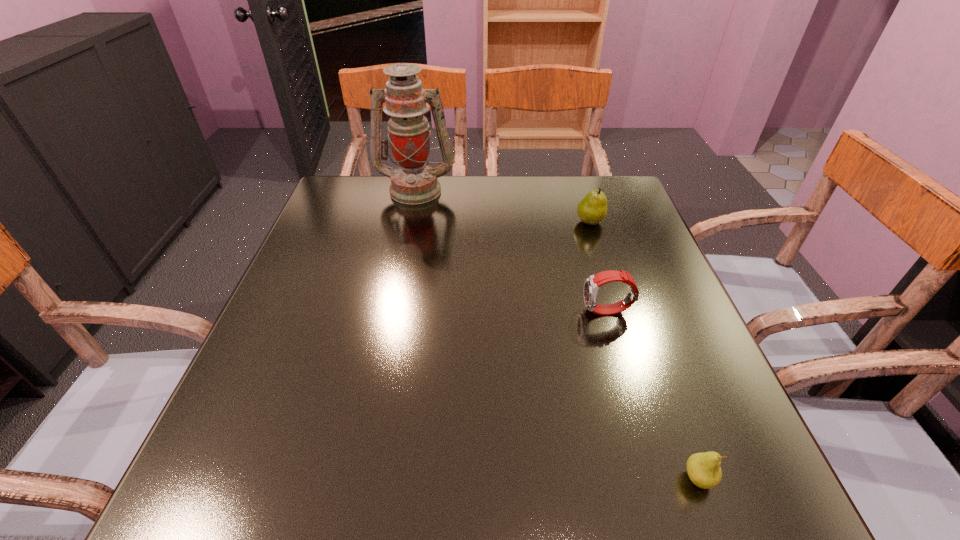
Image resolution: width=960 pixels, height=540 pixels. Find the location of `the tallest object`. the tallest object is located at coordinates (414, 182).

Locate an element on the screen. This screenshot has width=960, height=540. the farthest object is located at coordinates (414, 182).

Identify the location of the third nearest object. (592, 209).

What are the coordinates of `watch` in the screenshot? It's located at (592, 284).

At what (x,y) coordinates should I click in order to perform the action: click on the nearer pear. Please return your answer as a coordinate pair (x, y). The height and width of the screenshot is (540, 960). Looking at the image, I should click on (703, 469).

Locate an element on the screen. free space located 0.110m on the left of the leftmost object is located at coordinates (338, 189).

You are a GUI agent. You are given a task and a screenshot of the screen. Output one action in this format:
    pyautogui.click(x=<x>, y=<y>)
    Task: Click on the vacant space located on the front of the third nearest object
    
    Given the screenshot: What is the action you would take?
    tap(628, 339)

I want to click on vacant space located on the face of the third farthest object, so click(444, 312).

This screenshot has height=540, width=960. In order to click on vacant region located on the face of the third farthest object in this screenshot , I will do `click(415, 312)`.

This screenshot has height=540, width=960. Identify the location of vacant space located 0.300m on the face of the third farthest object. (435, 312).